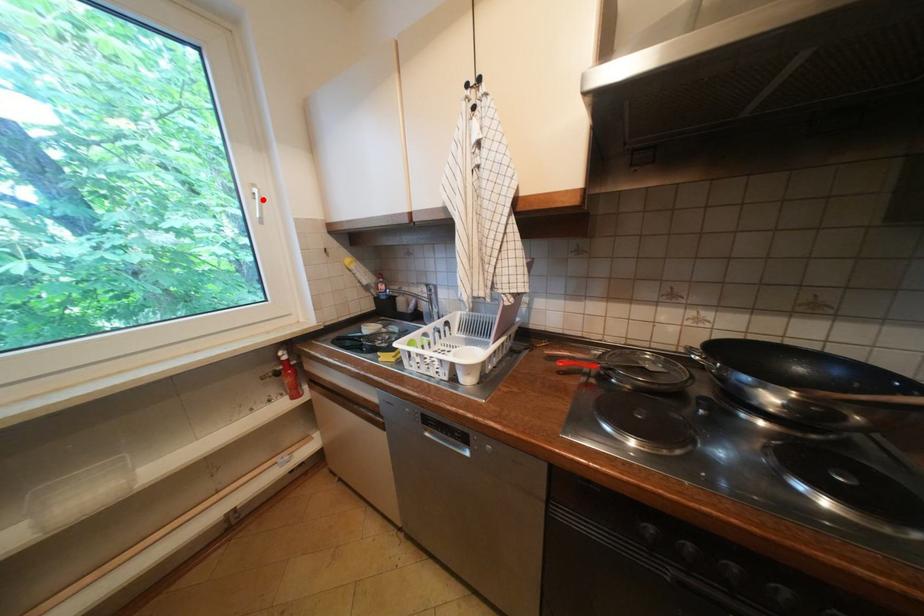
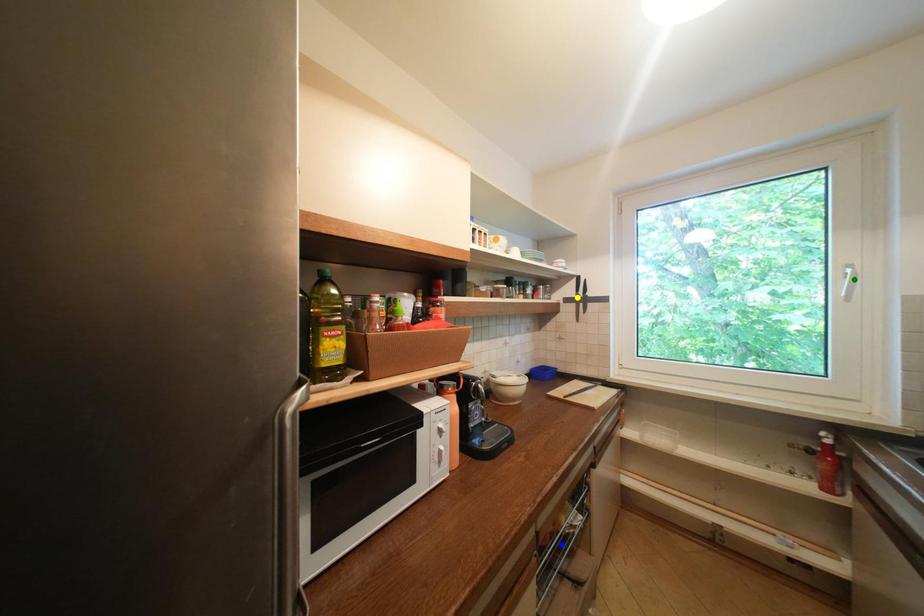
Question: I am providing you with two images of the same scene from different viewpoints. A red point is marked on the first image. You are given multiple points on the second image. Which point in image 2 represents the same 3d spot as the red point in image 1?

Choices:
 (A) yellow point
 (B) blue point
 (C) green point

Answer: (C)